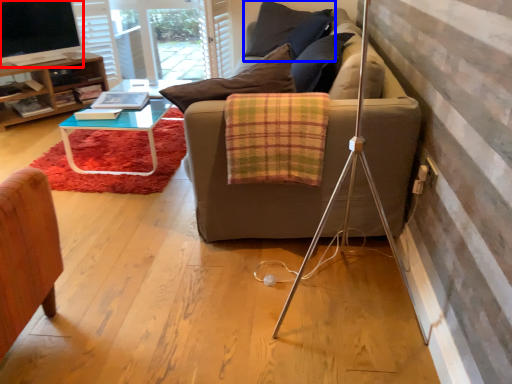
Question: Which object is closer to the camera taking this photo, television (highlighted by a red box) or pillow (highlighted by a blue box)?

Choices:
 (A) television
 (B) pillow

Answer: (A)